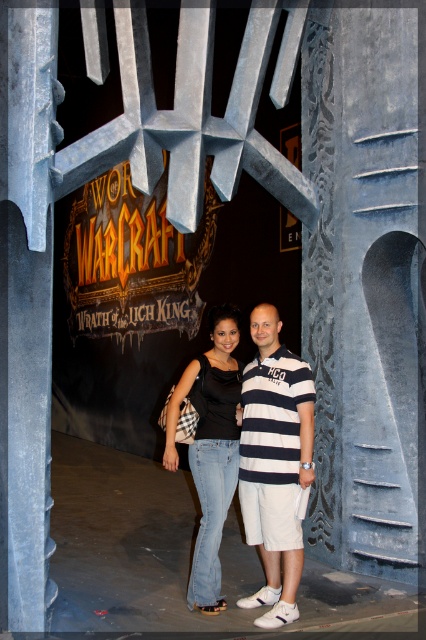
Question: Among these objects, which one is nearest to the camera?

Choices:
 (A) white striped polo shirt at center
 (B) denim jeans at center

Answer: (A)

Question: Where is white striped polo shirt at center located in relation to denim jeans at center in the image?

Choices:
 (A) below
 (B) above

Answer: (A)

Question: Which point appears farthest from the camera in this image?

Choices:
 (A) (284, 413)
 (B) (201, 508)

Answer: (B)

Question: Can you confirm if white striped polo shirt at center is positioned to the left of denim jeans at center?

Choices:
 (A) yes
 (B) no

Answer: (B)

Question: Does white striped polo shirt at center appear under denim jeans at center?

Choices:
 (A) no
 (B) yes

Answer: (B)